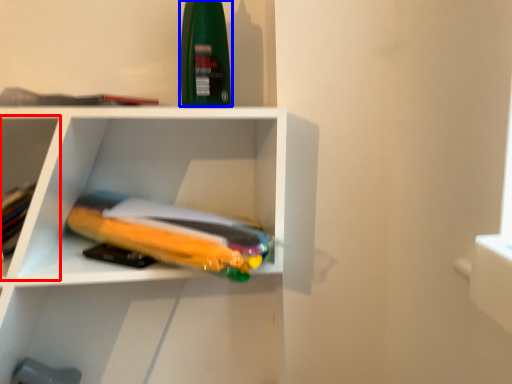
Question: Among these objects, which one is farthest to the camera, shelf (highlighted by a red box) or cleaning product (highlighted by a blue box)?

Choices:
 (A) shelf
 (B) cleaning product

Answer: (B)